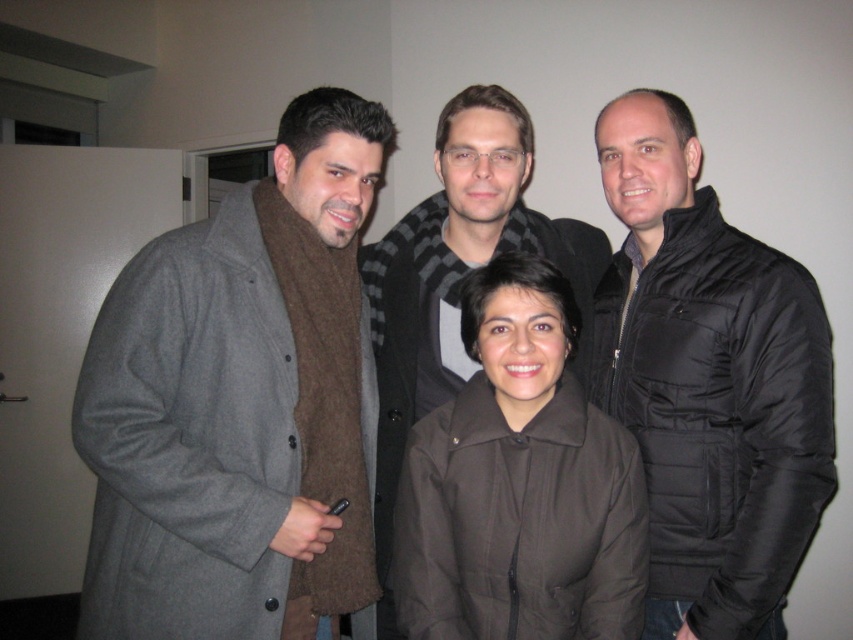
Question: Which point is closer to the camera?

Choices:
 (A) gray wool coat at left
 (B) brown matte jacket at center

Answer: (A)

Question: Which point appears closest to the camera in this image?

Choices:
 (A) (733, 392)
 (B) (473, 538)
 (C) (308, 467)

Answer: (B)

Question: Can you confirm if gray wool coat at left is positioned to the right of black quilted jacket at right?

Choices:
 (A) no
 (B) yes

Answer: (A)

Question: Can you confirm if gray wool coat at left is smaller than black quilted jacket at right?

Choices:
 (A) no
 (B) yes

Answer: (A)

Question: Which point appears closest to the camera in this image?

Choices:
 (A) (344, 560)
 (B) (601, 588)
 (C) (791, 294)

Answer: (B)

Question: From the image, what is the correct spatial relationship of gray wool coat at left in relation to brown matte jacket at center?

Choices:
 (A) left
 (B) right

Answer: (A)